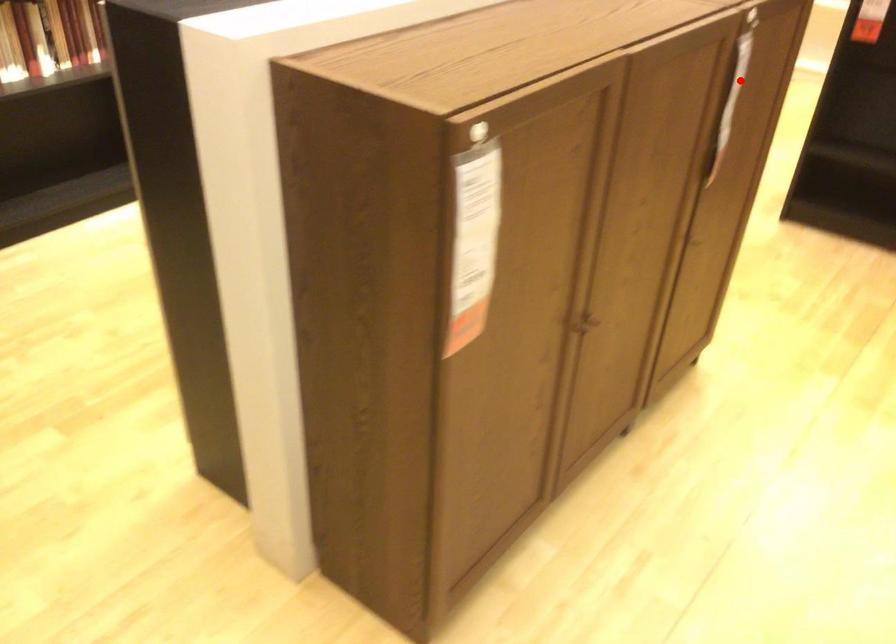
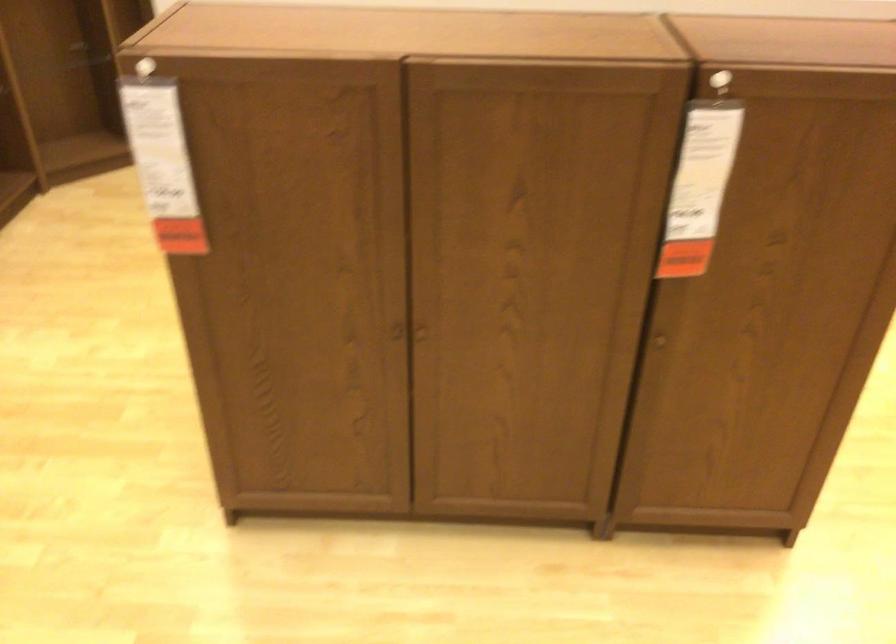
Where in the second image is the point corresponding to the highlighted location from the first image?

(702, 169)